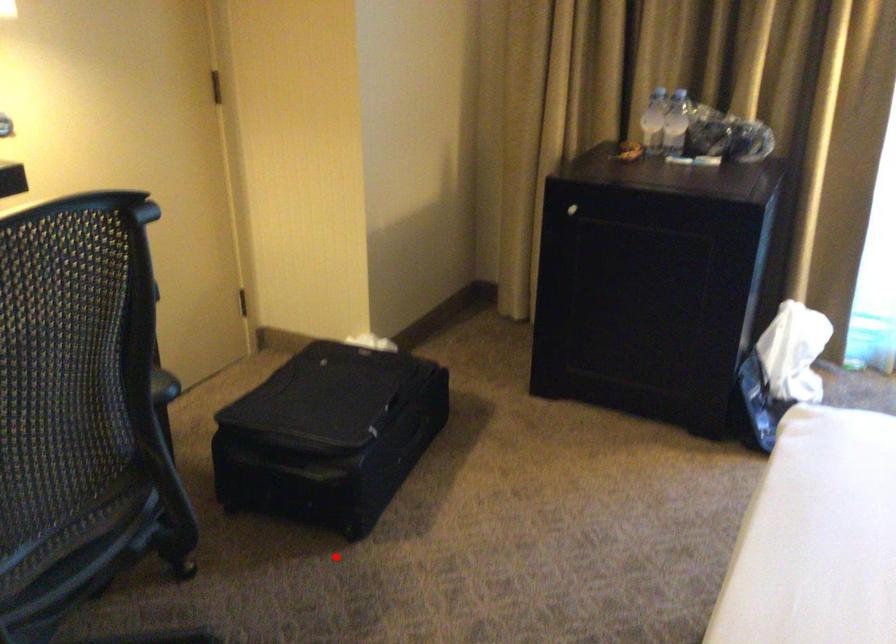
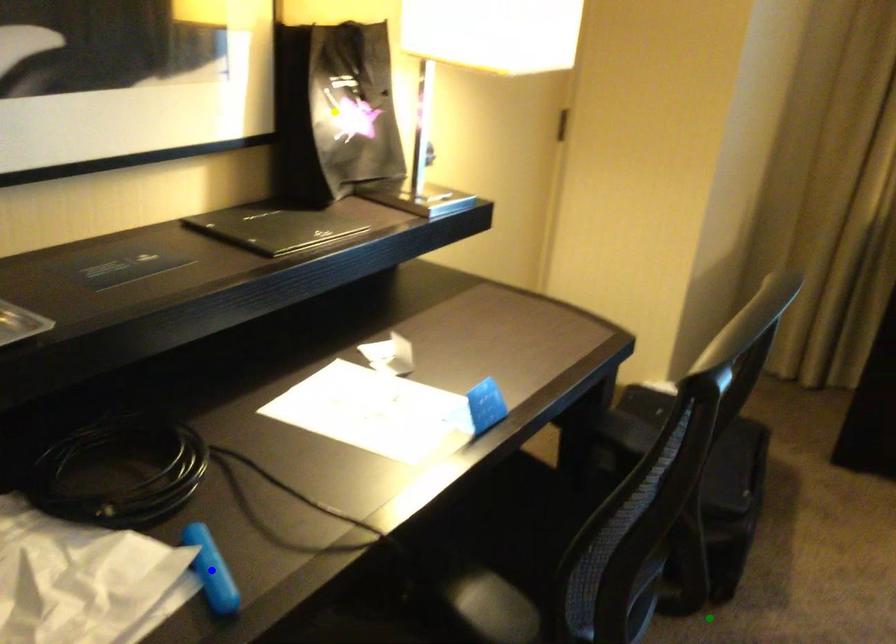
Question: I am providing you with two images of the same scene from different viewpoints. A red point is marked on the first image. You are given multiple points on the second image. In image 2, which mark is for the same physical point as the one in image 1?

Choices:
 (A) green point
 (B) yellow point
 (C) blue point

Answer: (A)